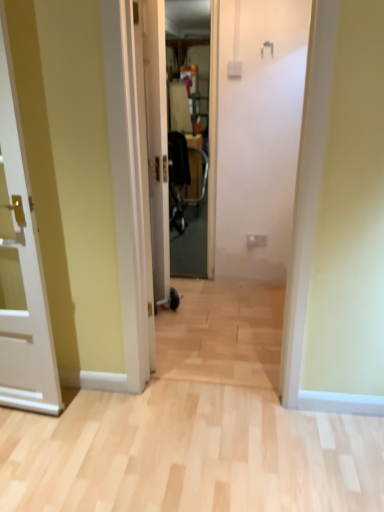
Question: From a real-world perspective, does white glossy door at center, the 2th door when ordered from left to right, sit lower than transparent plastic screen door at center?

Choices:
 (A) yes
 (B) no

Answer: (A)

Question: Is white glossy door at center, which is the 1th door from back to front, far away from transparent plastic screen door at center?

Choices:
 (A) yes
 (B) no

Answer: (A)

Question: From a real-world perspective, does white glossy door at center, which is the 1th door from back to front, stand above transparent plastic screen door at center?

Choices:
 (A) yes
 (B) no

Answer: (B)

Question: Are white glossy door at center, the 2th door when ordered from left to right, and transparent plastic screen door at center making contact?

Choices:
 (A) yes
 (B) no

Answer: (B)

Question: From the image's perspective, is white glossy door at center, marked as the 1th door in a right-to-left arrangement, above transparent plastic screen door at center?

Choices:
 (A) yes
 (B) no

Answer: (B)

Question: Does white glossy door at center, the 2th door when ordered from left to right, have a smaller size compared to transparent plastic screen door at center?

Choices:
 (A) yes
 (B) no

Answer: (B)

Question: From the image's perspective, is white glossy door at center, the 2th door when ordered from left to right, on top of white glossy door at left, which is the 2th door from back to front?

Choices:
 (A) yes
 (B) no

Answer: (A)

Question: Is white glossy door at center, which is the second door from front to back, turned away from white glossy door at left, the first door from the front?

Choices:
 (A) yes
 (B) no

Answer: (B)

Question: Can you confirm if white glossy door at center, marked as the 1th door in a right-to-left arrangement, is positioned to the right of white glossy door at left, which is the second door in right-to-left order?

Choices:
 (A) yes
 (B) no

Answer: (A)

Question: Is white glossy door at center, marked as the 1th door in a right-to-left arrangement, positioned behind white glossy door at left, which is the second door in right-to-left order?

Choices:
 (A) no
 (B) yes

Answer: (B)

Question: Can you confirm if white glossy door at center, which is the second door from front to back, is smaller than white glossy door at left, which is the second door in right-to-left order?

Choices:
 (A) yes
 (B) no

Answer: (A)

Question: Is white glossy door at center, which is the second door from front to back, thinner than white glossy door at left, which is the second door in right-to-left order?

Choices:
 (A) yes
 (B) no

Answer: (A)

Question: Is white glossy door at left, the first door from the front, a part of transparent plastic screen door at center?

Choices:
 (A) yes
 (B) no

Answer: (B)